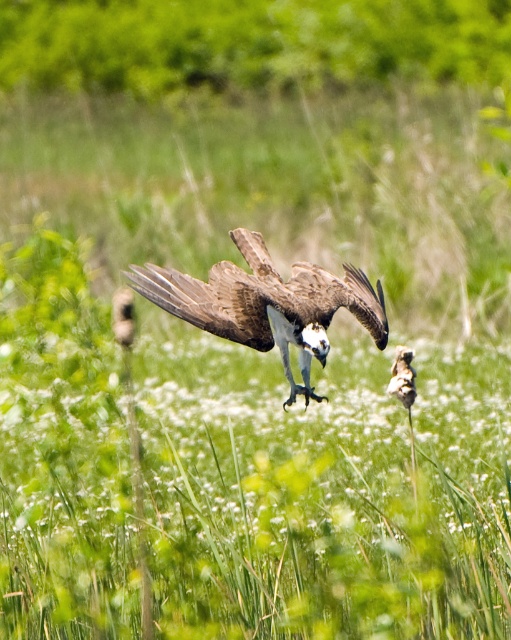
Question: Is brown textured eagle at center positioned in front of brown speckled bird at center?

Choices:
 (A) yes
 (B) no

Answer: (B)

Question: Among these objects, which one is farthest from the camera?

Choices:
 (A) brown textured eagle at center
 (B) brown speckled bird at center

Answer: (A)

Question: Does brown textured eagle at center come behind brown speckled bird at center?

Choices:
 (A) no
 (B) yes

Answer: (B)

Question: Among these objects, which one is nearest to the camera?

Choices:
 (A) brown textured eagle at center
 (B) brown speckled bird at center

Answer: (B)

Question: Does brown textured eagle at center appear on the left side of brown speckled bird at center?

Choices:
 (A) no
 (B) yes

Answer: (B)

Question: Which point appears closest to the camera in this image?

Choices:
 (A) (207, 284)
 (B) (411, 401)

Answer: (B)